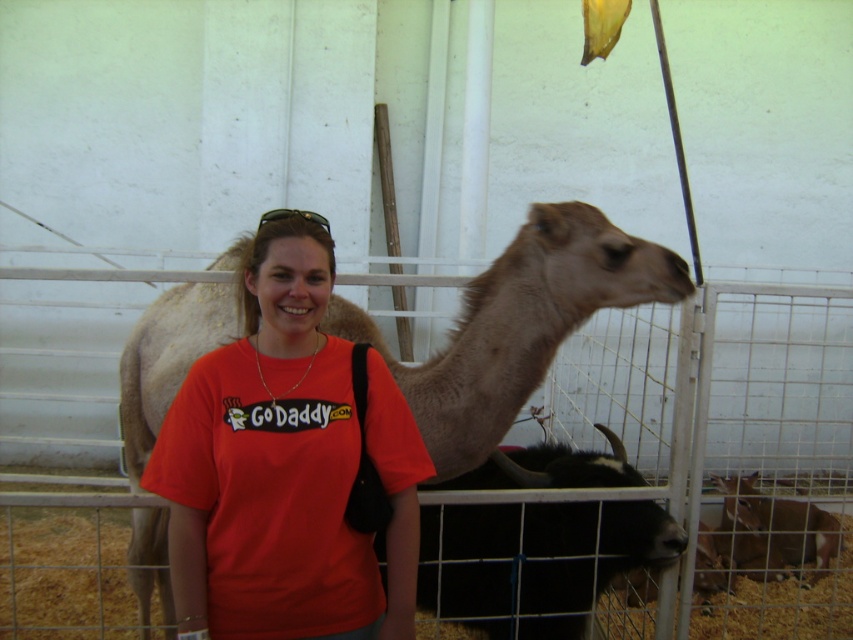
Question: Considering the relative positions of light brown fur at center and brown furry goat at lower right in the image provided, where is light brown fur at center located with respect to brown furry goat at lower right?

Choices:
 (A) below
 (B) above

Answer: (B)

Question: In this image, where is light brown fur at center located relative to brown furry goat at lower right?

Choices:
 (A) above
 (B) below

Answer: (A)

Question: Which object appears farthest from the camera in this image?

Choices:
 (A) brown furry goat at lower right
 (B) light brown fur at center

Answer: (A)

Question: In this image, where is light brown fur at center located relative to brown furry goat at lower right?

Choices:
 (A) below
 (B) above

Answer: (B)

Question: Which point is farther to the camera?

Choices:
 (A) (751, 573)
 (B) (152, 321)

Answer: (A)